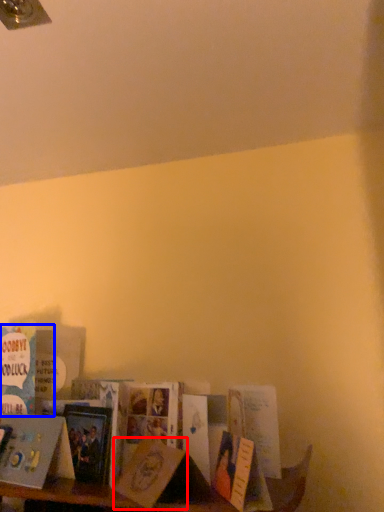
Question: Which object is closer to the camera taking this photo, paperback book (highlighted by a red box) or book (highlighted by a blue box)?

Choices:
 (A) paperback book
 (B) book

Answer: (A)